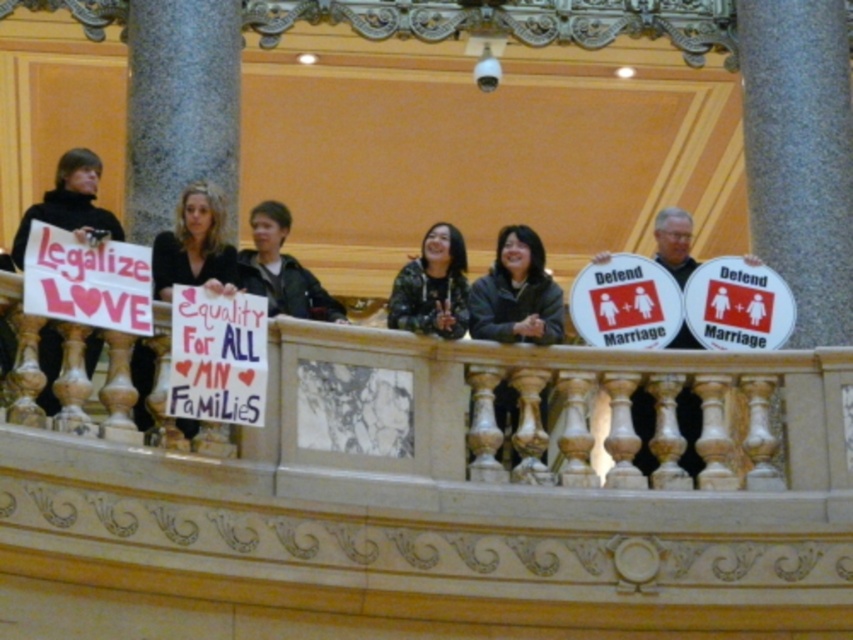
You are a photographer standing on the balcony and want to take a photo of the matte black shirt at center and the black matte sign at left. Which object should you focus on first if you want to capture both in the same frame without moving the camera?

The matte black shirt at center is positioned under the black matte sign at left, so you should focus on the black matte sign at left first to ensure both are in the frame.

You are a photographer trying to capture a clear photo of the matte black shirt at center and the black matte sign at left. Which object should you focus on first if you want to ensure both are in focus without adjusting the camera settings?

The matte black shirt at center has a lesser height compared to black matte sign at left, so you should focus on the black matte sign at left first because it is taller and requires more depth of field to capture fully.

You are a photographer trying to capture a clear photo of the black matte sign at left and the camouflage jacket at center from the front. Considering their heights, which object will appear taller in the photo?

The black matte sign at left appears taller in the photo because it has a greater height compared to the camouflage jacket at center.